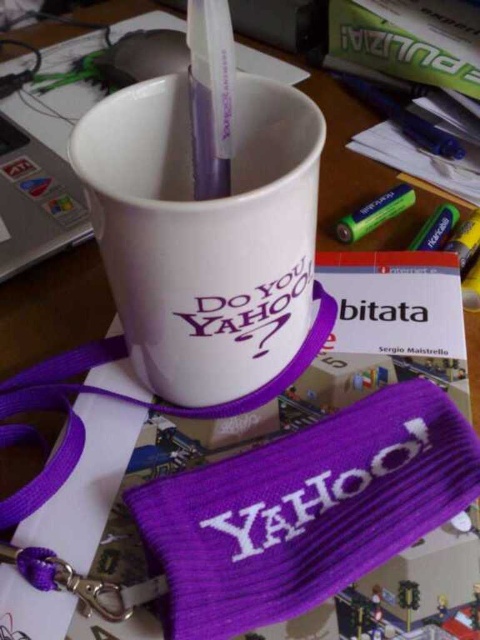
You are organizing your desk and want to place a ruler between the white ceramic mug at center and the green matte crayon at lower right. If the ruler is 10 inches long, will it fit perfectly between them?

The white ceramic mug at center is 9.91 inches away from the green matte crayon at lower right, so a 10 inch ruler will fit perfectly between them with a tiny bit of extra space.

What object is located at the coordinates point (204, 234) on the desk?

The point (204, 234) indicates the location of the white ceramic mug at center.

You have a small container that needs to hold the white plastic pencil at upper center. Can the white ceramic mug at center accommodate the pencil inside it?

The white ceramic mug at center is bigger than the white plastic pencil at upper center, so yes, the pencil can fit inside the mug.